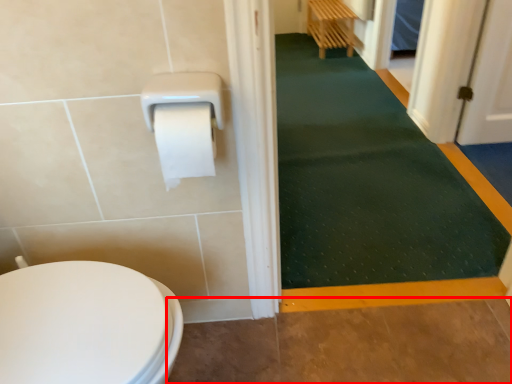
Question: From the image's perspective, what is the correct spatial positioning of path (annotated by the red box) in reference to bath mat?

Choices:
 (A) below
 (B) above

Answer: (A)